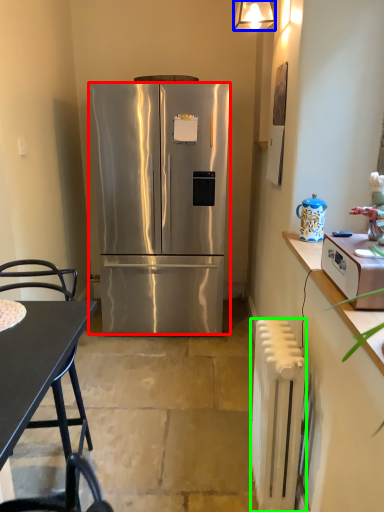
Question: Which is nearer to the refrigerator (highlighted by a red box)? lamp (highlighted by a blue box) or radiator (highlighted by a green box).

Choices:
 (A) lamp
 (B) radiator

Answer: (A)